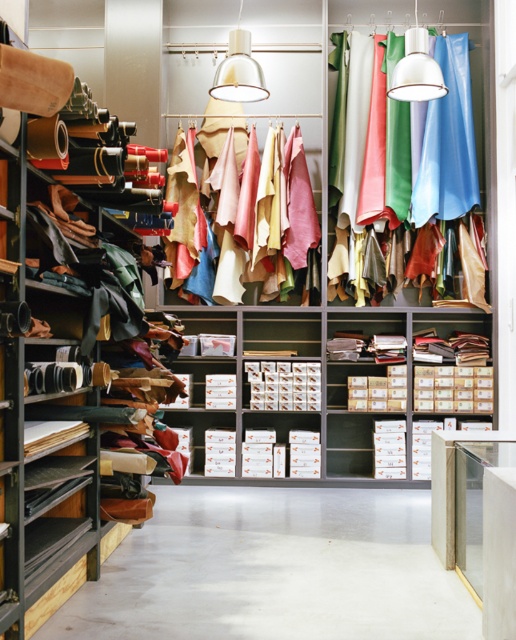
You are standing in the workshop and want to reach the point at coordinates point (261, 205). If your arm can extend 1.8 meters, can you reach that point?

The point (261, 205) is 5.78 meters from the viewer, which is farther than your arm can reach, so you cannot reach it.

What are the coordinates of the suede leather at center?

The suede leather at center is located at coordinates point (282, 211).